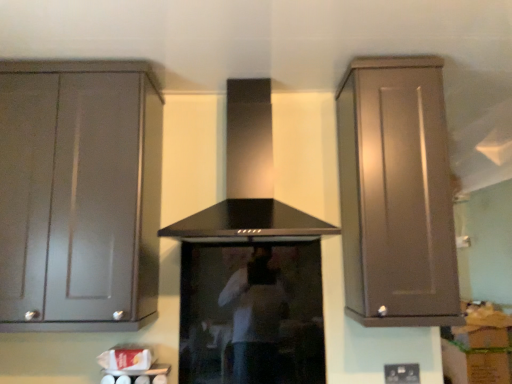
The image size is (512, 384). Find the location of `blank space above black matte vent at center (from a real-world perspective)`. blank space above black matte vent at center (from a real-world perspective) is located at coordinates (254, 63).